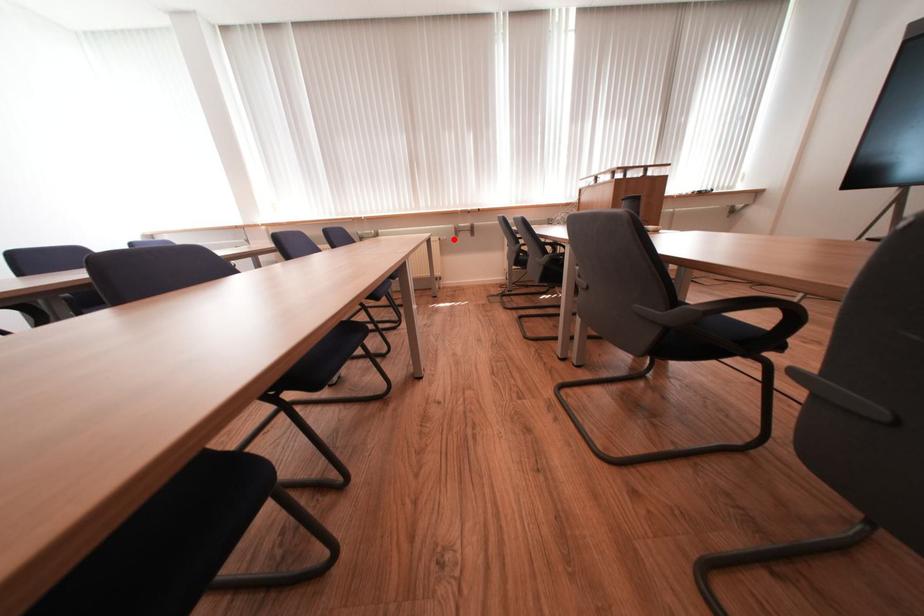
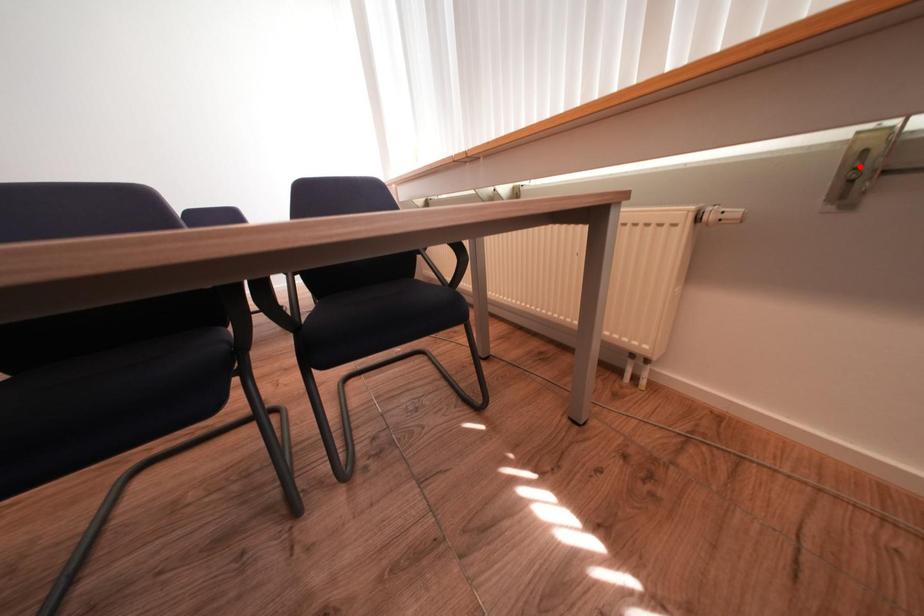
I am providing you with two images of the same scene from different viewpoints. A red point is marked on the first image and another point is marked on the second image. Does the point marked in image1 correspond to the same location as the one in image2?

No